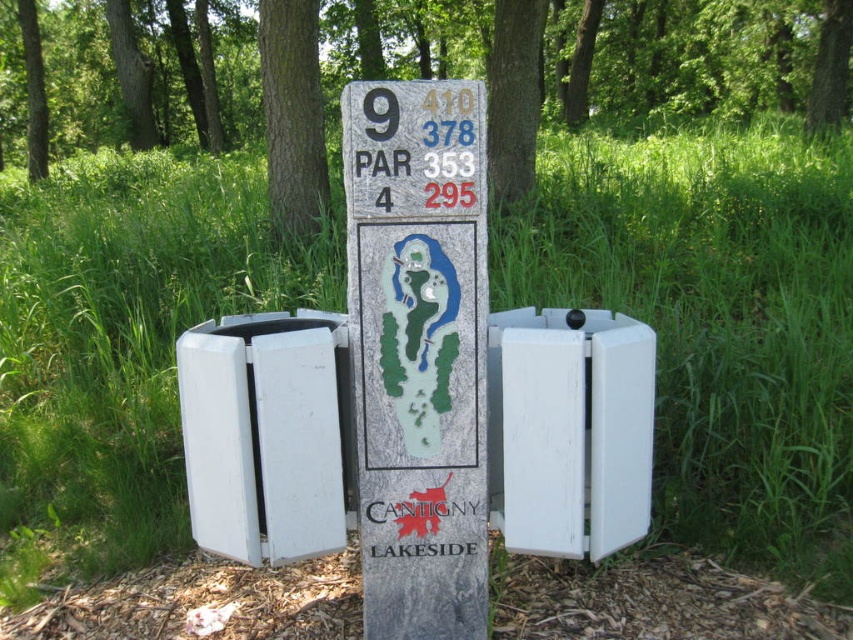
Question: Can you confirm if green textured tree at upper center is positioned above white painted wood at center?

Choices:
 (A) yes
 (B) no

Answer: (A)

Question: Can you confirm if green textured tree at upper center is smaller than smooth bark tree at upper center?

Choices:
 (A) yes
 (B) no

Answer: (B)

Question: Which point is closer to the camera taking this photo?

Choices:
 (A) (641, 504)
 (B) (305, 148)

Answer: (A)

Question: Is green textured tree at upper center wider than white plastic trash can at center?

Choices:
 (A) no
 (B) yes

Answer: (B)

Question: Which of these objects is positioned closest to the granite sign at center?

Choices:
 (A) smooth bark tree at upper center
 (B) green textured tree at upper center
 (C) brown rough bark tree at upper center

Answer: (C)

Question: Estimate the real-world distances between objects in this image. Which object is farther from the white painted wood at center?

Choices:
 (A) brown rough bark tree at upper center
 (B) white plastic trash can at center
 (C) green textured tree at upper center
 (D) smooth bark tree at upper center

Answer: (C)